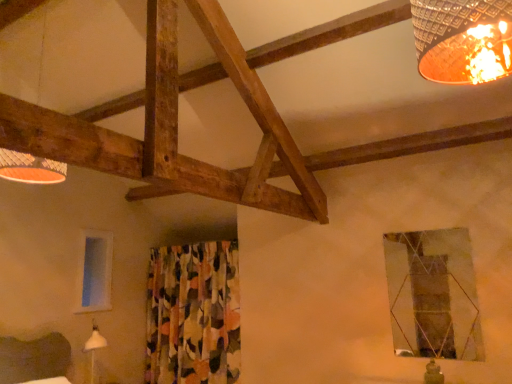
Question: From the image's perspective, is matte wooden lampshade at upper left beneath floral fabric curtain at center?

Choices:
 (A) no
 (B) yes

Answer: (A)

Question: Does matte wooden lampshade at upper left have a larger size compared to floral fabric curtain at center?

Choices:
 (A) no
 (B) yes

Answer: (A)

Question: From a real-world perspective, is matte wooden lampshade at upper left located higher than floral fabric curtain at center?

Choices:
 (A) yes
 (B) no

Answer: (A)

Question: From a real-world perspective, is matte wooden lampshade at upper left physically below floral fabric curtain at center?

Choices:
 (A) no
 (B) yes

Answer: (A)

Question: Can you confirm if matte wooden lampshade at upper left is thinner than floral fabric curtain at center?

Choices:
 (A) yes
 (B) no

Answer: (B)

Question: Does matte wooden lampshade at upper left have a lesser height compared to floral fabric curtain at center?

Choices:
 (A) no
 (B) yes

Answer: (B)

Question: Considering the relative sizes of matte wooden lampshade at upper left and transparent glass window at left, which is the first window from left to right, in the image provided, is matte wooden lampshade at upper left taller than transparent glass window at left, which is the first window from left to right,?

Choices:
 (A) yes
 (B) no

Answer: (A)

Question: Is matte wooden lampshade at upper left bigger than transparent glass window at left, placed as the second window when sorted from front to back?

Choices:
 (A) yes
 (B) no

Answer: (A)

Question: Is matte wooden lampshade at upper left directly adjacent to transparent glass window at left, placed as the second window when sorted from front to back?

Choices:
 (A) no
 (B) yes

Answer: (A)

Question: Is matte wooden lampshade at upper left far from transparent glass window at left, which is the first window from left to right?

Choices:
 (A) yes
 (B) no

Answer: (A)

Question: Is matte wooden lampshade at upper left to the right of transparent glass window at left, positioned as the second window in right-to-left order, from the viewer's perspective?

Choices:
 (A) yes
 (B) no

Answer: (A)

Question: From a real-world perspective, is matte wooden lampshade at upper left beneath transparent glass window at left, placed as the second window when sorted from front to back?

Choices:
 (A) no
 (B) yes

Answer: (A)

Question: From a real-world perspective, does metallic reflective window at upper right, placed as the 1th window when sorted from front to back, stand above matte wooden lampshade at upper left?

Choices:
 (A) yes
 (B) no

Answer: (B)